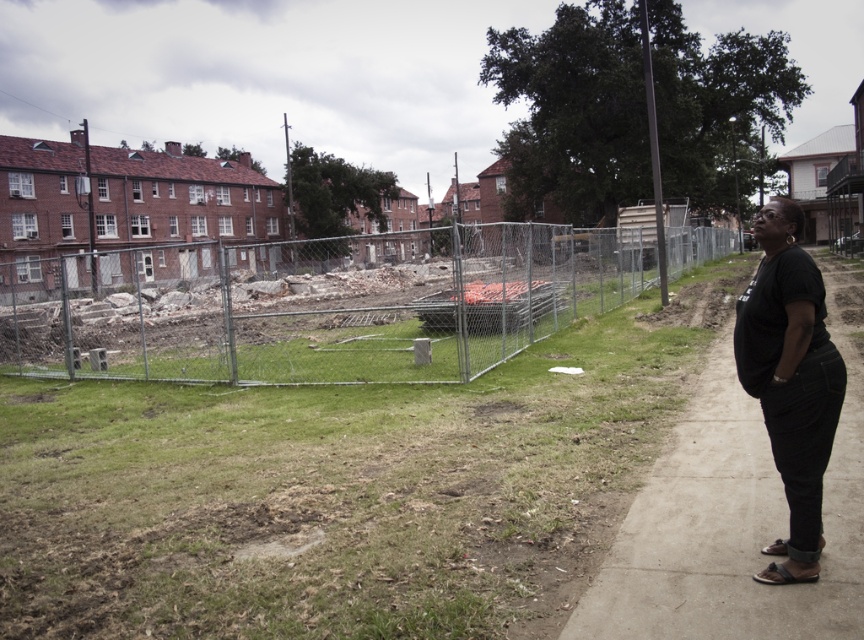
Between point (256, 272) and point (769, 230), which one is positioned in front?

Point (769, 230) is more forward.

Which is more to the right, metal chain-link fence at center or black cotton shirt at right?

From the viewer's perspective, black cotton shirt at right appears more on the right side.

Identify the location of metal chain-link fence at center. This screenshot has width=864, height=640. (319, 307).

Is concrete sidewalk at right wider than black cotton shirt at right?

Yes.

Can you confirm if concrete sidewalk at right is positioned to the left of black cotton shirt at right?

Correct, you'll find concrete sidewalk at right to the left of black cotton shirt at right.

Which is behind, point (678, 584) or point (810, 305)?

Positioned behind is point (678, 584).

I want to click on concrete sidewalk at right, so click(735, 513).

Between point (566, 244) and point (845, 337), which one is positioned behind?

Point (566, 244)

Identify the location of metal chain-link fence at center. Image resolution: width=864 pixels, height=640 pixels. (319, 307).